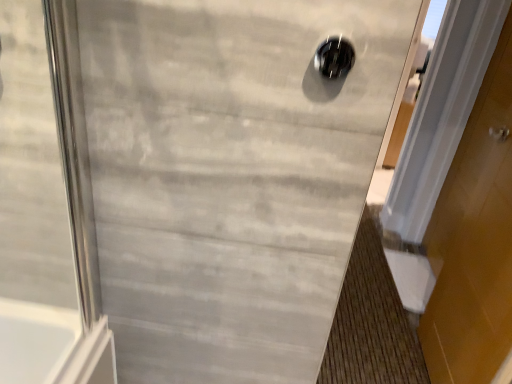
Question: Is black glossy hole at upper center spatially inside white wood door at right, or outside of it?

Choices:
 (A) inside
 (B) outside

Answer: (B)

Question: Does point (326, 48) appear closer or farther from the camera than point (459, 220)?

Choices:
 (A) closer
 (B) farther

Answer: (A)

Question: From a real-world perspective, relative to white wood door at right, is black glossy hole at upper center vertically above or below?

Choices:
 (A) above
 (B) below

Answer: (A)

Question: From their relative heights in the image, would you say white wood door at right is taller or shorter than black glossy hole at upper center?

Choices:
 (A) short
 (B) tall

Answer: (B)

Question: From the image's perspective, is white wood door at right positioned above or below black glossy hole at upper center?

Choices:
 (A) below
 (B) above

Answer: (A)

Question: From a real-world perspective, is white wood door at right above or below black glossy hole at upper center?

Choices:
 (A) above
 (B) below

Answer: (B)

Question: Looking at their shapes, would you say white wood door at right is wider or thinner than black glossy hole at upper center?

Choices:
 (A) thin
 (B) wide

Answer: (B)